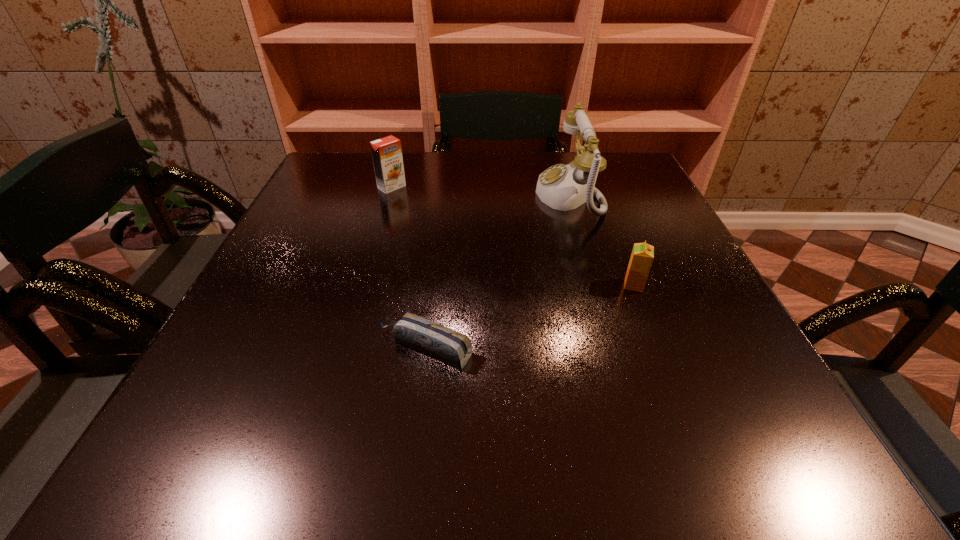
The width and height of the screenshot is (960, 540). I want to click on vacant space located 0.190m on the right of the leftmost object, so click(x=481, y=187).

I want to click on vacant space located on the front of the nearer orange juice, so click(x=646, y=316).

Identify the location of vacant region located on the back of the nearest object. (438, 244).

Locate an element on the screen. The image size is (960, 540). telephone present at the far edge is located at coordinates (562, 187).

You are a GUI agent. You are given a task and a screenshot of the screen. Output one action in this format:
    pyautogui.click(x=<x>, y=<y>)
    Task: Click on the orange juice at the far edge
    
    Given the screenshot: What is the action you would take?
    pyautogui.click(x=387, y=157)

In order to click on telephone present at the right edge in this screenshot , I will do `click(562, 187)`.

I want to click on orange juice present at the right edge, so [x=642, y=256].

The width and height of the screenshot is (960, 540). I want to click on object that is at the far right corner, so click(x=562, y=187).

Locate an element on the screen. The image size is (960, 540). free space at the far edge is located at coordinates (571, 156).

Find the location of a particular element. The height and width of the screenshot is (540, 960). free space at the near edge of the desktop is located at coordinates (303, 452).